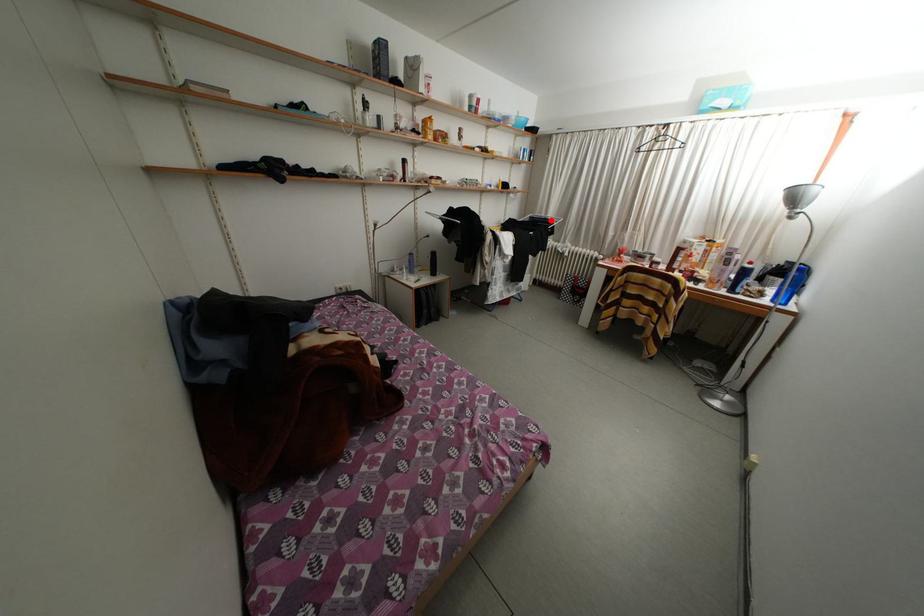
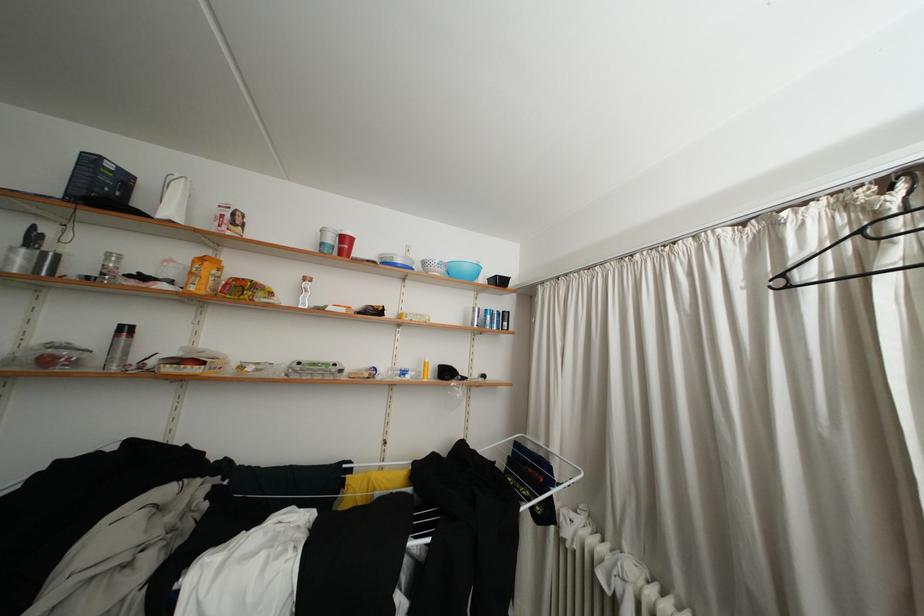
Find the pixel in the second image that matches the highlighted location in the first image.

(550, 448)